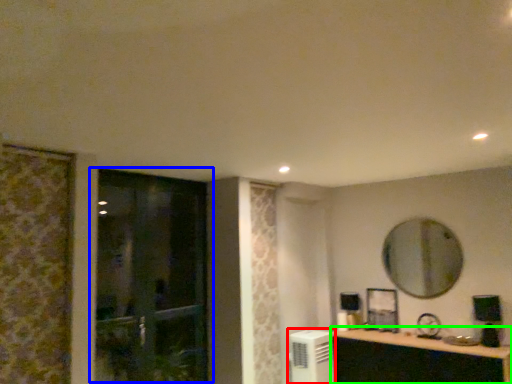
Question: Which is farther away from air conditioner (highlighted by a red box)? door (highlighted by a blue box) or cabinetry (highlighted by a green box)?

Choices:
 (A) door
 (B) cabinetry

Answer: (A)